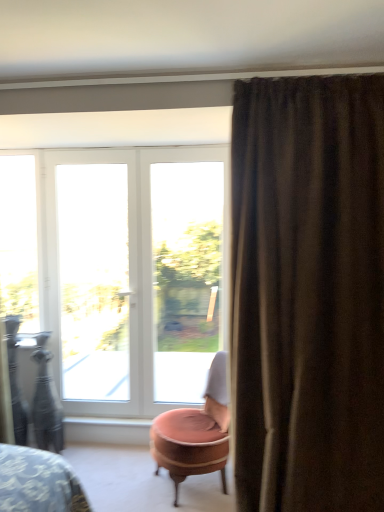
I want to click on free point below pink velvet ottoman at center (from a real-world perspective), so click(189, 488).